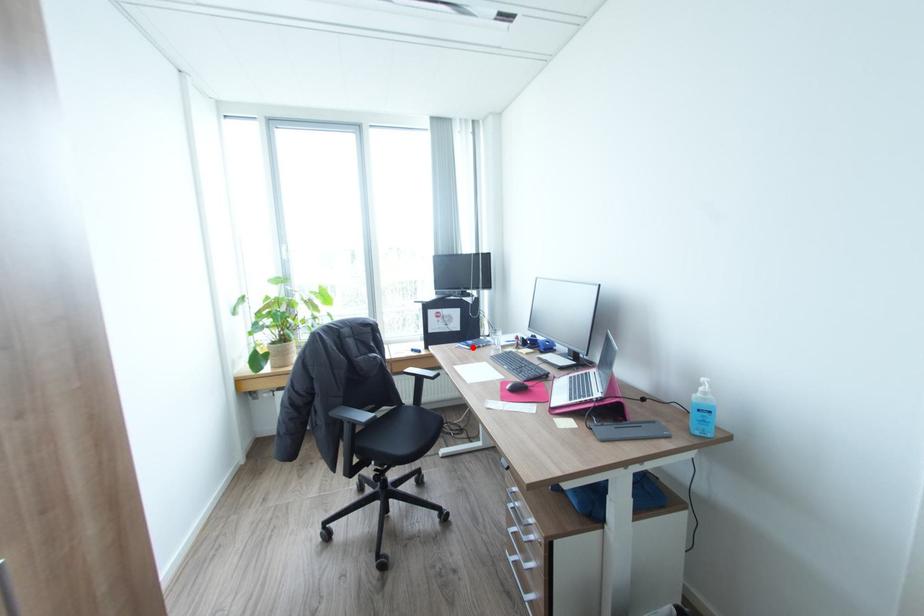
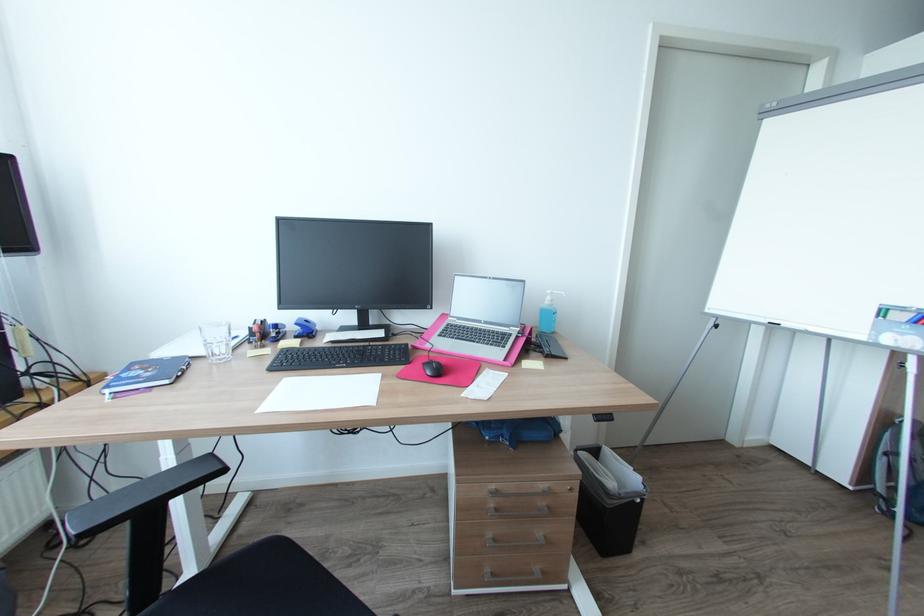
In the second image, find the point that corresponds to the highlighted location in the first image.

(171, 381)